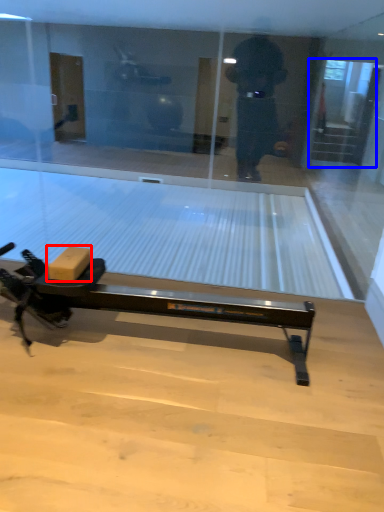
Question: Which object appears closest to the camera in this image, cardboard box (highlighted by a red box) or screen door (highlighted by a blue box)?

Choices:
 (A) cardboard box
 (B) screen door

Answer: (A)